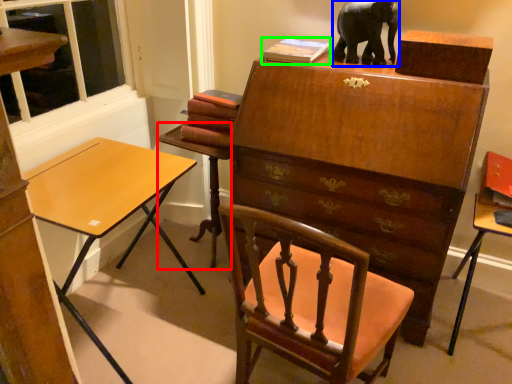
Question: Estimate the real-world distances between objects in this image. Which object is closer to table (highlighted by a red box), elephant (highlighted by a blue box) or book (highlighted by a green box)?

Choices:
 (A) elephant
 (B) book

Answer: (B)